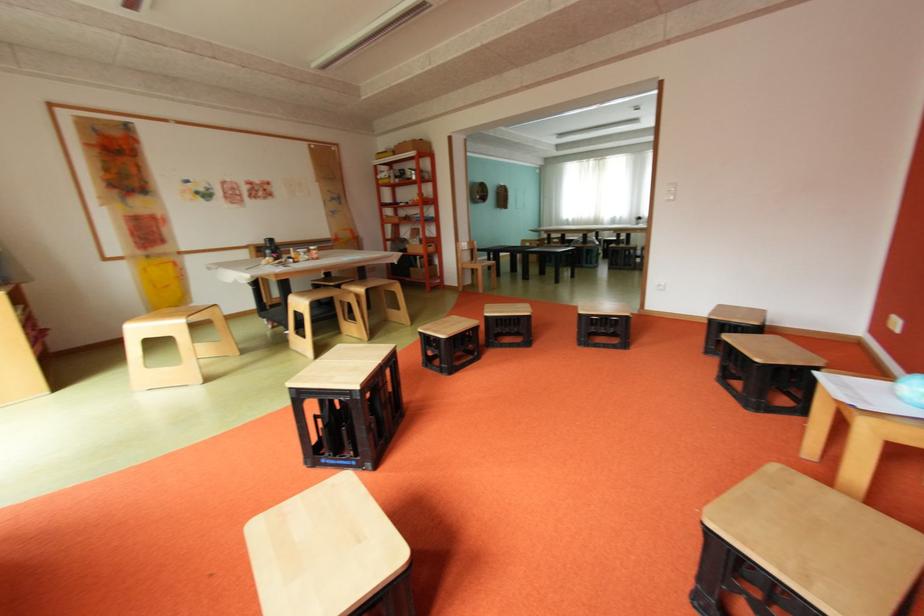
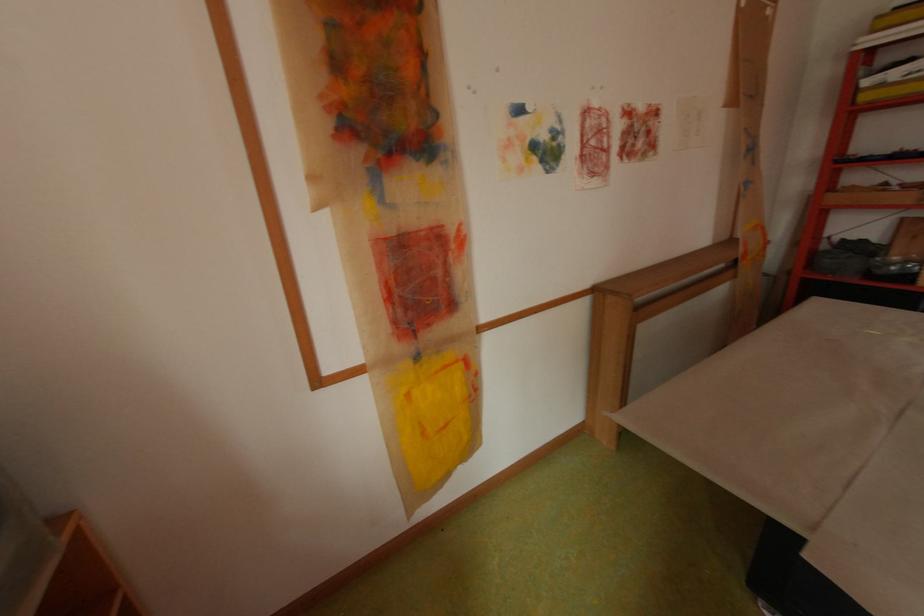
Find the pixel in the second image that matches pixel 157 257 in the first image.

(429, 358)